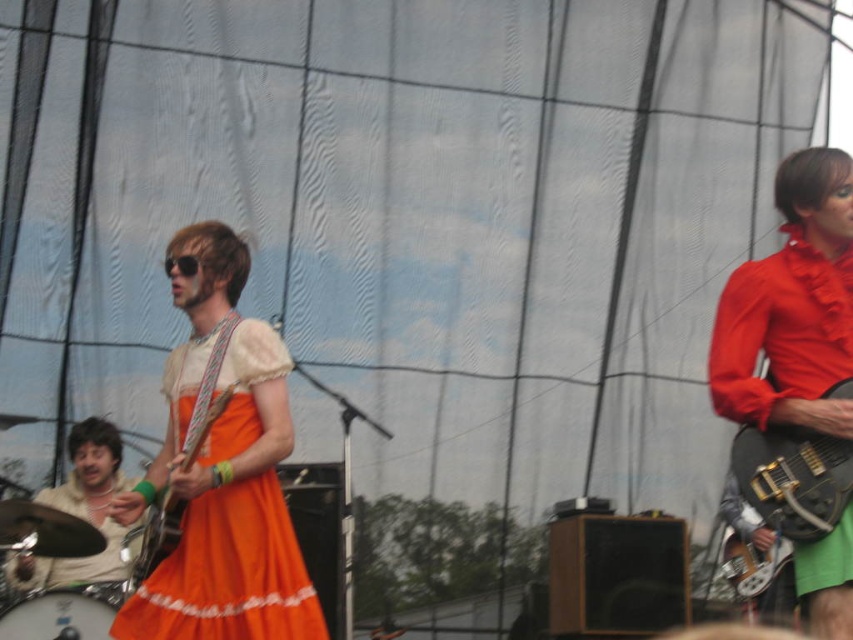
You are a photographer trying to capture the musician in the orange satin dress at center and the drum set in the beige fabric drum set at lower left. Which object is positioned lower in the image?

The orange satin dress at center is located below the beige fabric drum set at lower left, so the orange satin dress at center is positioned lower in the image.

You are a stagehand who needs to adjust the microphone stand between the matte red blouse at right and the black glossy electric guitar at right. The stand requires at least 30 inches of space to fit. Can you place it there?

The matte red blouse at right and the black glossy electric guitar at right are 32.83 inches apart, which is more than enough space for the microphone stand requiring 30 inches. Yes, you can place it there.

You are a photographer positioned at the front of the stage. You want to capture a close shot of the musician in the bright orange dress with white trim at the bottom. There are two points marked on your camera screen at coordinates point (85, 486) and point (112, 595). Which point should you focus on to ensure the musician is in focus?

You should focus on point (85, 486) because it is closer to the viewer than point (112, 595), ensuring the musician in the bright orange dress with white trim at the bottom is in focus.